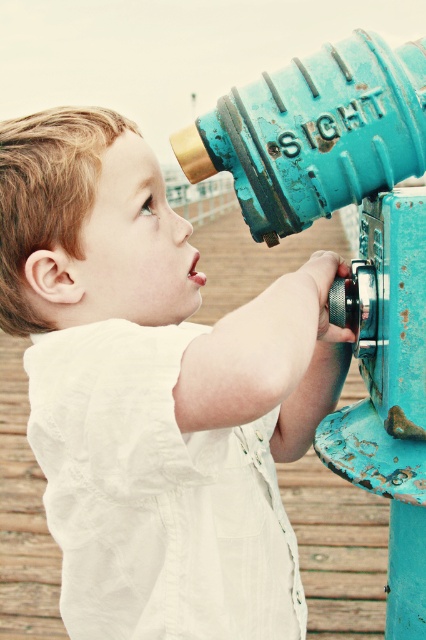
Question: Among these points, which one is nearest to the camera?

Choices:
 (A) (382, 195)
 (B) (92, 392)

Answer: (B)

Question: Which point is farther from the camera taking this photo?

Choices:
 (A) (215, 518)
 (B) (402, 356)

Answer: (A)

Question: Does matte blue telescope at center have a greater width compared to teal matte/rough sightseeing telescope at center?

Choices:
 (A) no
 (B) yes

Answer: (B)

Question: Is matte blue telescope at center smaller than teal matte/rough sightseeing telescope at center?

Choices:
 (A) yes
 (B) no

Answer: (B)

Question: Which point is farther to the camera?

Choices:
 (A) (83, 358)
 (B) (423, 452)

Answer: (B)

Question: Is the position of matte blue telescope at center less distant than that of teal matte/rough sightseeing telescope at center?

Choices:
 (A) yes
 (B) no

Answer: (A)